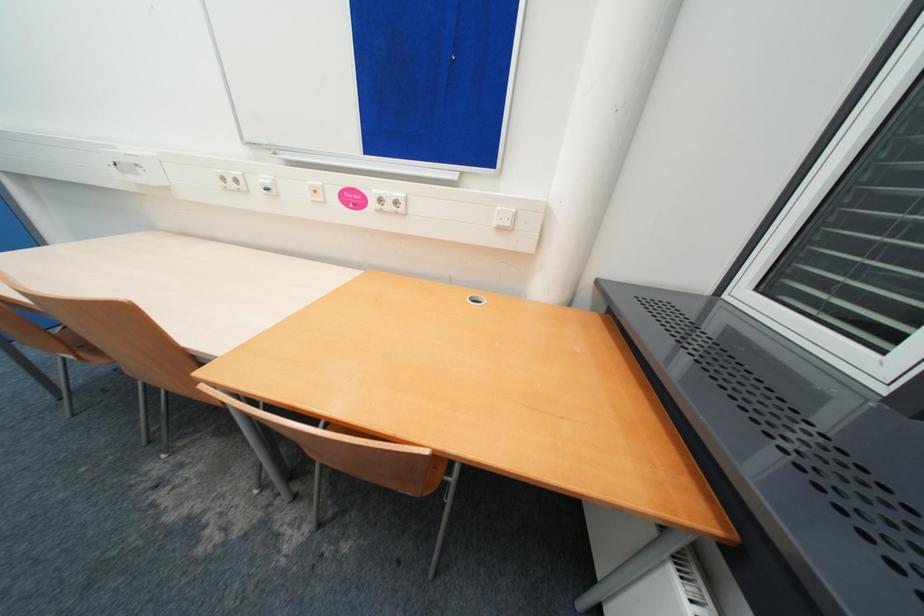
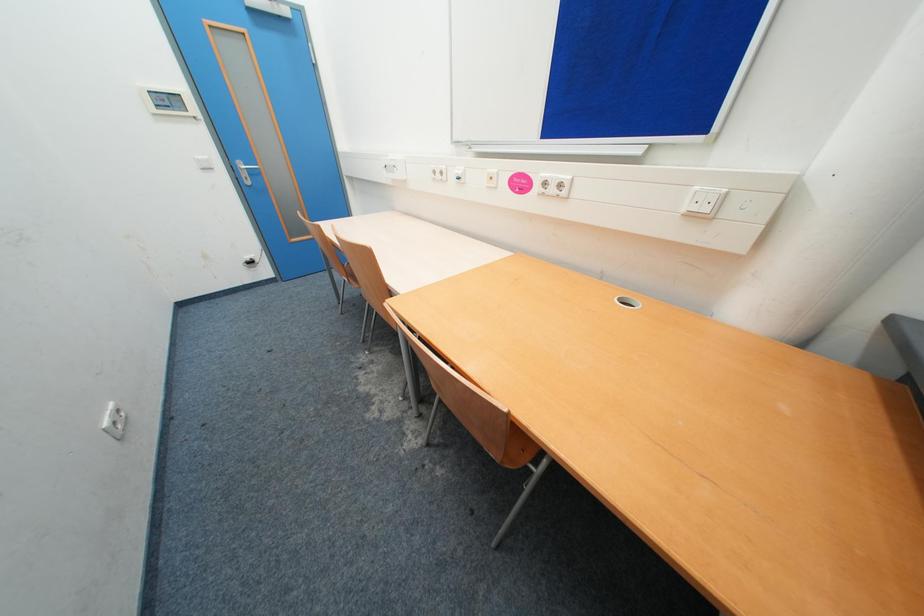
Question: Based on the continuous images, in which direction is the camera rotating? Reply with the corresponding letter.

Choices:
 (A) Left
 (B) Right
 (C) Up
 (D) Down

Answer: (A)